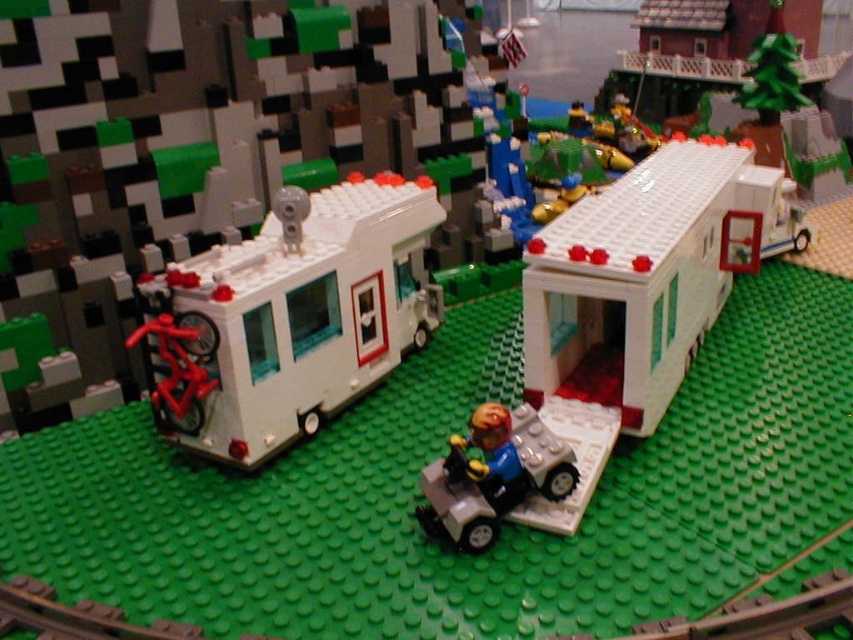
Question: Is white plastic camper at left closer to camera compared to light gray plastic car at center?

Choices:
 (A) yes
 (B) no

Answer: (B)

Question: Which point is farther from the camera taking this photo?

Choices:
 (A) (474, 464)
 (B) (320, 332)

Answer: (B)

Question: Does white plastic camper at left lie behind light gray plastic car at center?

Choices:
 (A) no
 (B) yes

Answer: (B)

Question: Is white plastic camper at left smaller than light gray plastic car at center?

Choices:
 (A) yes
 (B) no

Answer: (B)